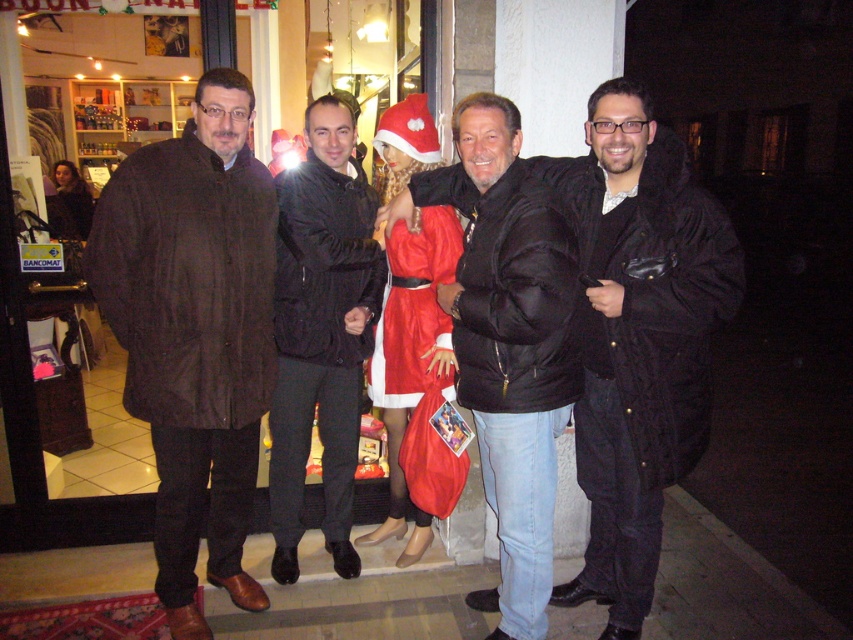
Question: Which is farther from the shiny red fabric santa at center?

Choices:
 (A) brown textured coat at left
 (B) black puffy jacket at center
 (C) black leather jacket at center

Answer: (A)

Question: Is brown textured coat at left to the left of shiny red fabric santa at center from the viewer's perspective?

Choices:
 (A) yes
 (B) no

Answer: (A)

Question: Which of these objects is positioned closest to the shiny red fabric santa at center?

Choices:
 (A) black puffy jacket at center
 (B) black fur coat at right
 (C) brown textured coat at left
 (D) black leather jacket at center

Answer: (D)

Question: Does black puffy jacket at center appear under shiny red fabric santa at center?

Choices:
 (A) no
 (B) yes

Answer: (B)

Question: Which object is the closest to the black puffy jacket at center?

Choices:
 (A) black fur coat at right
 (B) brown textured coat at left
 (C) black leather jacket at center

Answer: (A)

Question: Can you confirm if black fur coat at right is positioned below shiny red fabric santa at center?

Choices:
 (A) no
 (B) yes

Answer: (B)